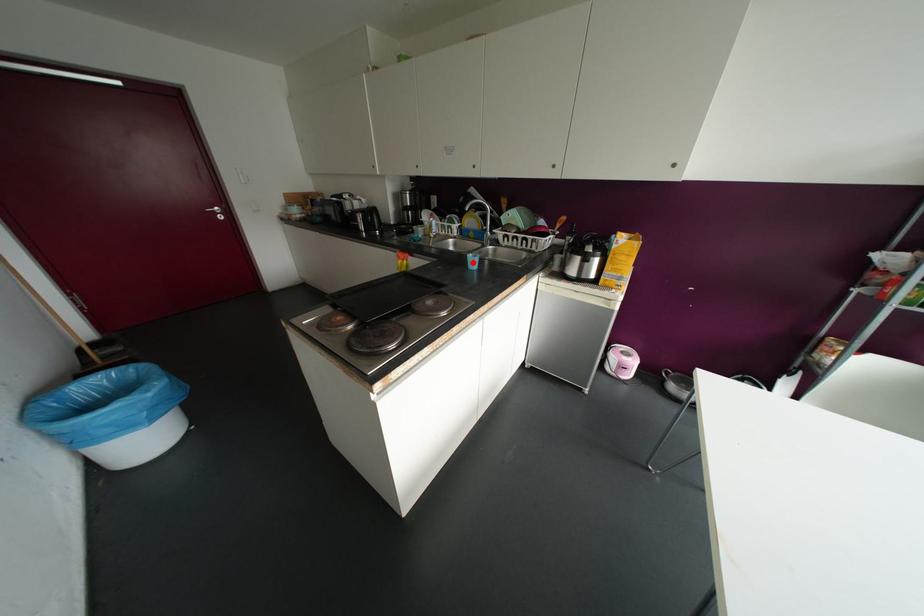
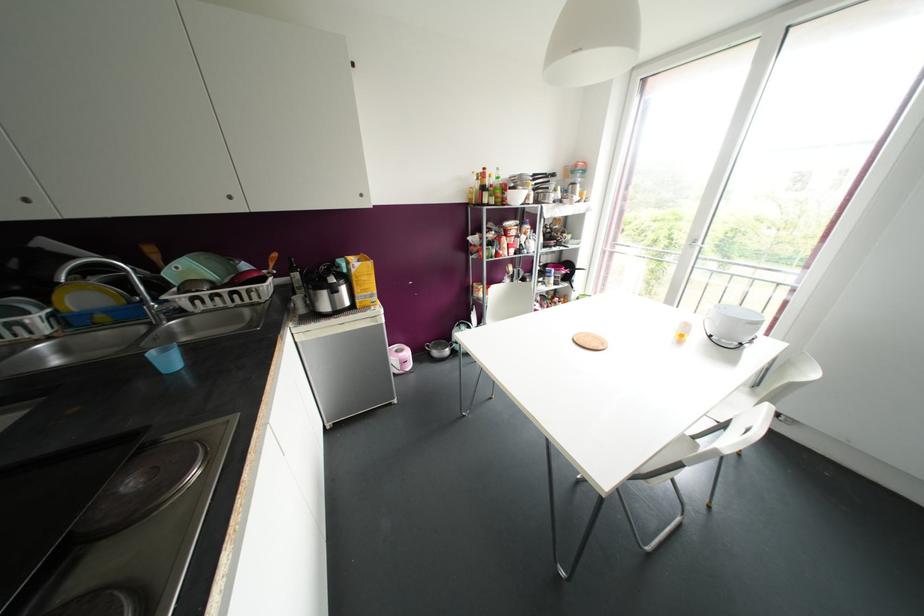
Find the pixel in the second image that matches the highlighted location in the first image.

(168, 361)